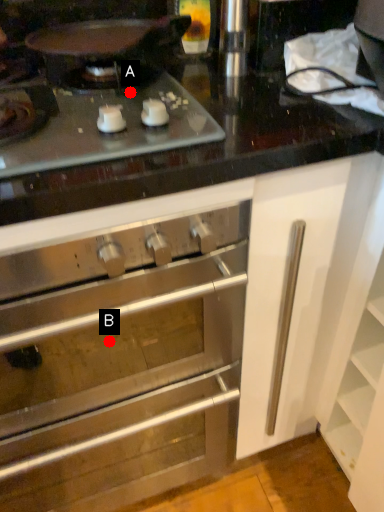
Question: Two points are circled on the image, labeled by A and B beside each circle. Which point is farther to the camera?

Choices:
 (A) A is further
 (B) B is further

Answer: (B)